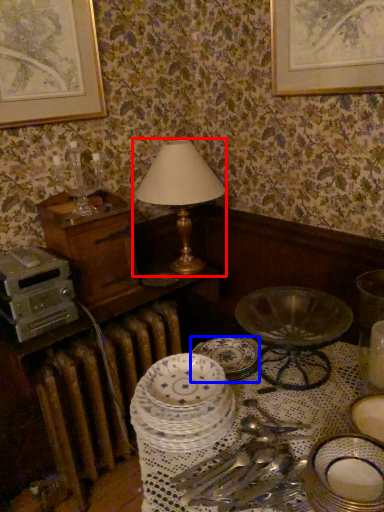
Question: Among these objects, which one is nearest to the camera, table lamp (highlighted by a red box) or plate (highlighted by a blue box)?

Choices:
 (A) table lamp
 (B) plate

Answer: (B)